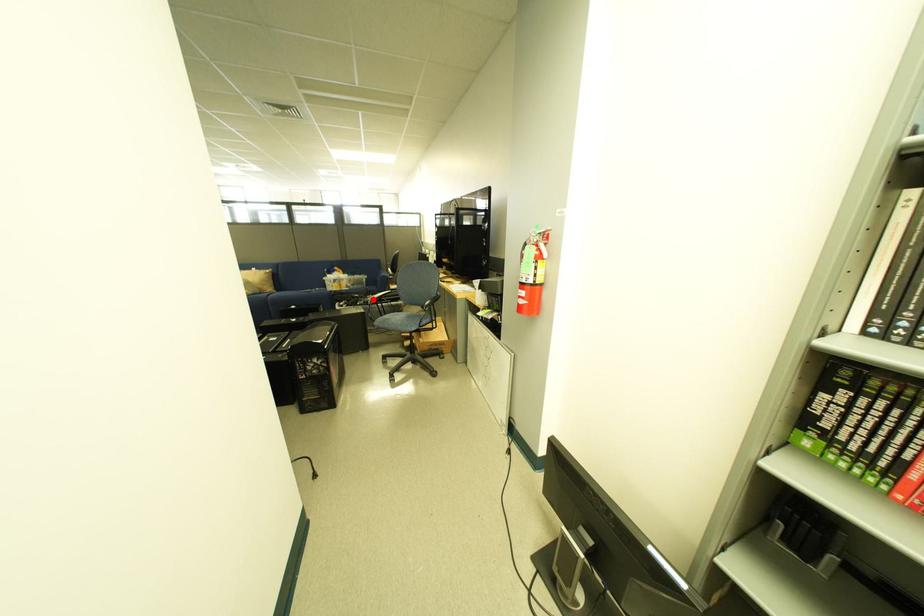
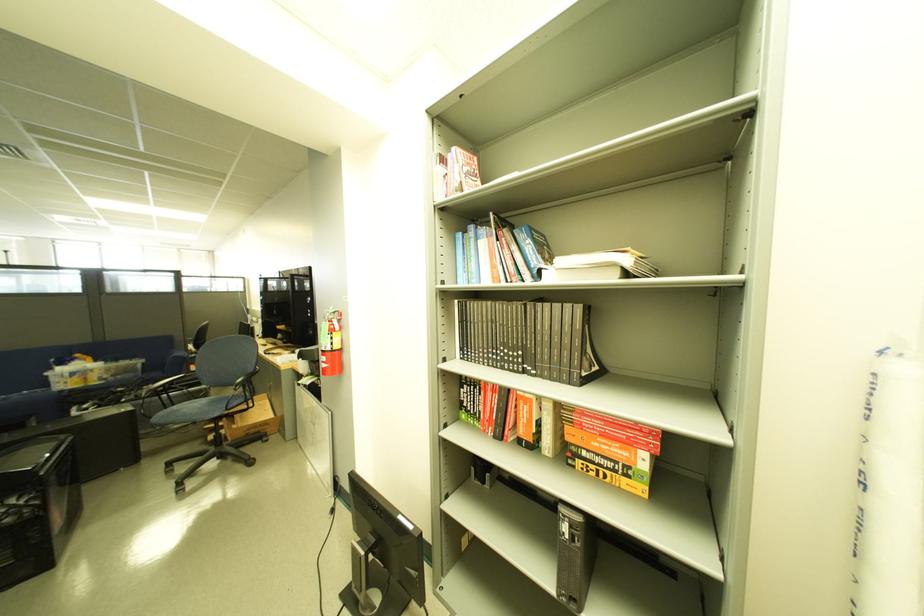
Question: I am providing you with two images of the same scene from different viewpoints. Image1 has a red point marked. In image2, the corresponding 3D location appears at what relative position? Reply with the corresponding letter.

Choices:
 (A) Closer
 (B) Farther

Answer: (B)